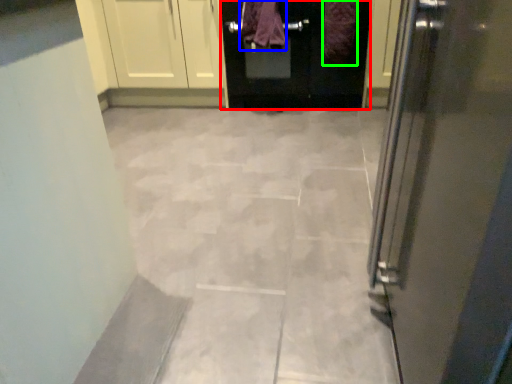
Question: Which is nearer to the door (highlighted by a red box)? blanket (highlighted by a blue box) or blanket (highlighted by a green box).

Choices:
 (A) blanket
 (B) blanket

Answer: (A)